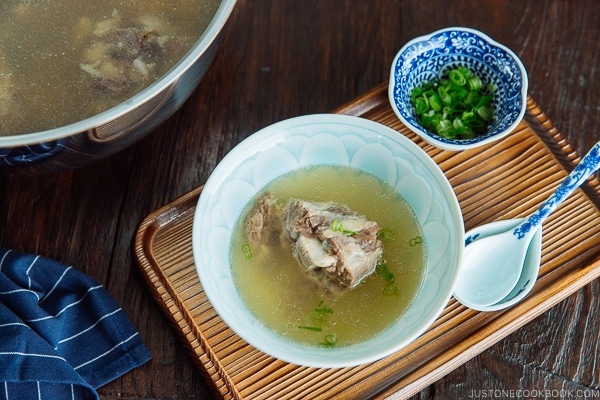
At what (x,y) coordinates should I click in order to perform the action: click on silver bowl. Please return your answer as a coordinate pair (x, y). The image size is (600, 400). Looking at the image, I should click on (194, 71).